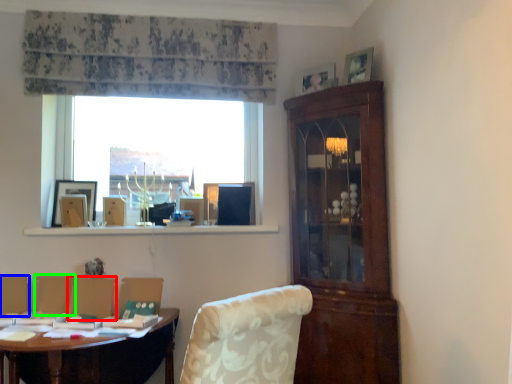
Question: Which object is positioned farthest from armchair (highlighted by a red box)? Select from armchair (highlighted by a blue box) and armchair (highlighted by a green box).

Choices:
 (A) armchair
 (B) armchair

Answer: (A)